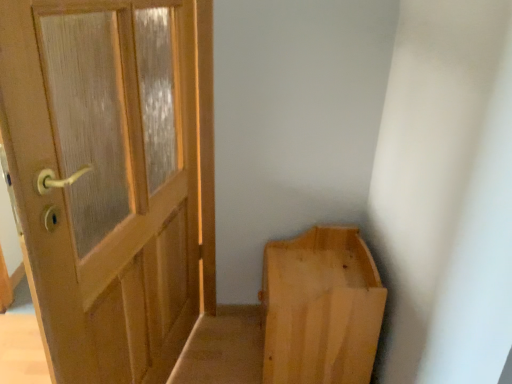
Image resolution: width=512 pixels, height=384 pixels. Identify the location of matte wood door at left. (112, 177).

What do you see at coordinates (112, 177) in the screenshot?
I see `matte wood door at left` at bounding box center [112, 177].

Locate an element on the screen. light wood/rough plank bench at lower right is located at coordinates (320, 308).

In order to face light wood/rough plank bench at lower right, should I rotate leftwards or rightwards?

It's best to rotate right around 8.143 degrees.

What do you see at coordinates (320, 308) in the screenshot? I see `light wood/rough plank bench at lower right` at bounding box center [320, 308].

What is the approximate width of light wood/rough plank bench at lower right?

It is 16.89 inches.

This screenshot has height=384, width=512. I want to click on matte wood door at left, so click(x=112, y=177).

Which is more to the left, matte wood door at left or light wood/rough plank bench at lower right?

From the viewer's perspective, matte wood door at left appears more on the left side.

Between matte wood door at left and light wood/rough plank bench at lower right, which one is positioned in front?

matte wood door at left.

Does point (210, 252) lie in front of point (356, 337)?

No.

From the image's perspective, is matte wood door at left located above or below light wood/rough plank bench at lower right?

From the image's perspective, matte wood door at left appears above light wood/rough plank bench at lower right.

In the scene shown: From a real-world perspective, is matte wood door at left located higher than light wood/rough plank bench at lower right?

Yes, from a real-world perspective, matte wood door at left is over light wood/rough plank bench at lower right

Looking at their sizes, would you say matte wood door at left is wider or thinner than light wood/rough plank bench at lower right?

matte wood door at left is thinner than light wood/rough plank bench at lower right.

Is matte wood door at left shorter than light wood/rough plank bench at lower right?

Incorrect, the height of matte wood door at left does not fall short of that of light wood/rough plank bench at lower right.

Considering the sizes of objects matte wood door at left and light wood/rough plank bench at lower right in the image provided, who is smaller, matte wood door at left or light wood/rough plank bench at lower right?

light wood/rough plank bench at lower right is smaller.

Is matte wood door at left outside of light wood/rough plank bench at lower right?

Yes, matte wood door at left is located beyond the bounds of light wood/rough plank bench at lower right.

Is matte wood door at left not close to light wood/rough plank bench at lower right?

No.

Is matte wood door at left facing towards light wood/rough plank bench at lower right?

No.

Can you tell me how much matte wood door at left and light wood/rough plank bench at lower right differ in facing direction?

The angle between the facing direction of matte wood door at left and the facing direction of light wood/rough plank bench at lower right is 13.9 degrees.

Image resolution: width=512 pixels, height=384 pixels. In the image, there is a light wood/rough plank bench at lower right. What are the coordinates of `door above it (from the image's perspective)` in the screenshot? It's located at (112, 177).

Between light wood/rough plank bench at lower right and matte wood door at left, which one appears on the right side from the viewer's perspective?

light wood/rough plank bench at lower right.

Which object is further away from the camera, light wood/rough plank bench at lower right or matte wood door at left?

light wood/rough plank bench at lower right is further from the camera.

Consider the image. Which is less distant, (304, 370) or (134, 4)?

Point (134, 4)

Consider the image. From the image's perspective, which is above, light wood/rough plank bench at lower right or matte wood door at left?

matte wood door at left is shown above in the image.

From a real-world perspective, which object rests below the other?

light wood/rough plank bench at lower right.

Is light wood/rough plank bench at lower right wider or thinner than matte wood door at left?

Considering their sizes, light wood/rough plank bench at lower right looks broader than matte wood door at left.

Between light wood/rough plank bench at lower right and matte wood door at left, which one has less height?

Standing shorter between the two is light wood/rough plank bench at lower right.

Considering the sizes of light wood/rough plank bench at lower right and matte wood door at left in the image, is light wood/rough plank bench at lower right bigger or smaller than matte wood door at left?

In the image, light wood/rough plank bench at lower right appears to be smaller than matte wood door at left.

Is light wood/rough plank bench at lower right outside of matte wood door at left?

Absolutely, light wood/rough plank bench at lower right is external to matte wood door at left.

Is there a large distance between light wood/rough plank bench at lower right and matte wood door at left?

No.

Could you tell me if light wood/rough plank bench at lower right is facing matte wood door at left?

Yes, light wood/rough plank bench at lower right faces towards matte wood door at left.

How different are the orientations of light wood/rough plank bench at lower right and matte wood door at left in degrees?

light wood/rough plank bench at lower right and matte wood door at left are facing 13.9 degrees away from each other.

Locate an element on the screen. This screenshot has width=512, height=384. furniture lying behind the matte wood door at left is located at coordinates (320, 308).

At what (x,y) coordinates should I click in order to perform the action: click on furniture behind the matte wood door at left. Please return your answer as a coordinate pair (x, y). Looking at the image, I should click on 320,308.

Image resolution: width=512 pixels, height=384 pixels. In the image, there is a matte wood door at left. Find the location of `furniture below it (from the image's perspective)`. furniture below it (from the image's perspective) is located at coordinates (320, 308).